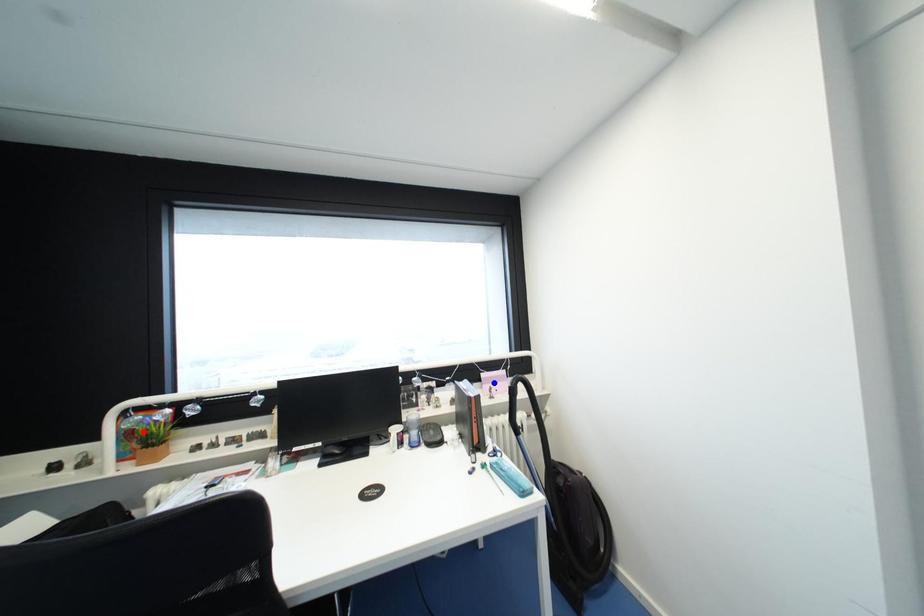
Question: In the image, two points are highlighted. Which point is nearer to the camera? Reply with the corresponding letter.

Choices:
 (A) blue point
 (B) red point

Answer: (B)